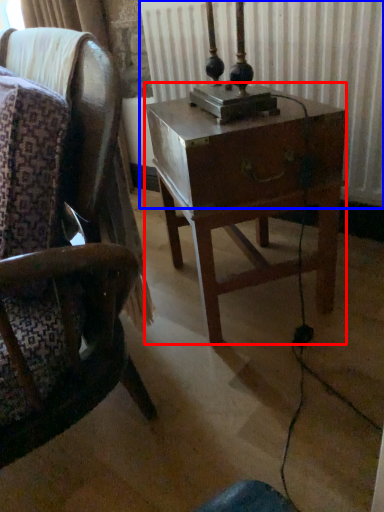
Question: Which of the following is the farthest to the observer, nightstand (highlighted by a red box) or radiator (highlighted by a blue box)?

Choices:
 (A) nightstand
 (B) radiator

Answer: (B)